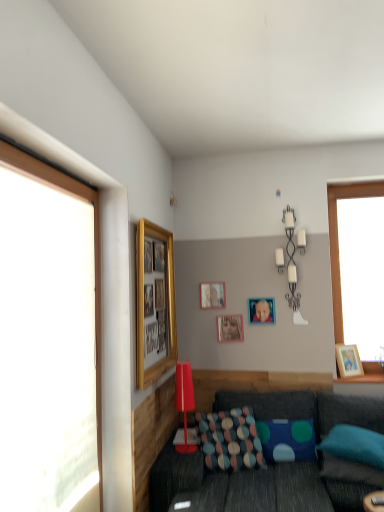
Image resolution: width=384 pixels, height=512 pixels. In order to click on blue fabric pillow at lower right, which is counted as the 3th pillow, starting from the left in this screenshot , I will do `click(355, 445)`.

What do you see at coordinates (184, 402) in the screenshot? I see `matte red lamp at center, which ranks as the 1th lamp in bottom-to-top order` at bounding box center [184, 402].

The height and width of the screenshot is (512, 384). Describe the element at coordinates (230, 439) in the screenshot. I see `textured fabric pillow at lower center, the 1th pillow positioned from the left` at that location.

Find the location of a particular element. wooden picture frame at right, the fifth picture frame in the left-to-right sequence is located at coordinates (348, 360).

What do you see at coordinates (348, 360) in the screenshot? I see `wooden picture frame at right, the fifth picture frame in the left-to-right sequence` at bounding box center [348, 360].

Find the location of a particular element. The image size is (384, 512). blue fabric pillow at lower right, the 1th pillow when ordered from right to left is located at coordinates (355, 445).

Looking at this image, between blue fabric pillow at lower right, the 1th pillow when ordered from right to left, and transparent glass window at left, which one appears on the right side from the viewer's perspective?

blue fabric pillow at lower right, the 1th pillow when ordered from right to left, is more to the right.

Is point (380, 438) in front of point (100, 342)?

No.

From a real-world perspective, between blue fabric pillow at lower right, the 1th pillow when ordered from right to left, and transparent glass window at left, who is vertically lower?

From a 3D spatial view, blue fabric pillow at lower right, the 1th pillow when ordered from right to left, is below.

Considering the sizes of objects blue fabric pillow at lower right, which is counted as the 3th pillow, starting from the left, and transparent glass window at left in the image provided, who is taller, blue fabric pillow at lower right, which is counted as the 3th pillow, starting from the left, or transparent glass window at left?

transparent glass window at left is taller.

Image resolution: width=384 pixels, height=512 pixels. Identify the location of pillow that is above the textured fabric pillow at lower center, the third pillow viewed from the right (from a real-world perspective). pyautogui.click(x=355, y=445).

Between blue fabric pillow at lower right, the 1th pillow when ordered from right to left, and textured fabric pillow at lower center, the third pillow viewed from the right, which one is positioned in front?

blue fabric pillow at lower right, the 1th pillow when ordered from right to left.

Are blue fabric pillow at lower right, the 1th pillow when ordered from right to left, and textured fabric pillow at lower center, the 1th pillow positioned from the left, located far from each other?

No.

Is blue fabric pillow at lower right, which is counted as the 3th pillow, starting from the left, spatially inside textured fabric pillow at lower center, the 1th pillow positioned from the left, or outside of it?

blue fabric pillow at lower right, which is counted as the 3th pillow, starting from the left, is spatially situated outside textured fabric pillow at lower center, the 1th pillow positioned from the left.

What's the angular difference between gold/glossy picture frame at upper left, acting as the fifth picture frame starting from the back, and textured fabric pillow at lower center, the third pillow viewed from the right,'s facing directions?

The angular difference between gold/glossy picture frame at upper left, acting as the fifth picture frame starting from the back, and textured fabric pillow at lower center, the third pillow viewed from the right, is 75.9 degrees.

Based on their positions, is gold/glossy picture frame at upper left, the 1th picture frame viewed from the front, located to the left or right of textured fabric pillow at lower center, the 1th pillow positioned from the left?

gold/glossy picture frame at upper left, the 1th picture frame viewed from the front, is to the left of textured fabric pillow at lower center, the 1th pillow positioned from the left.

Based on their sizes in the image, would you say gold/glossy picture frame at upper left, which appears as the first picture frame when viewed from the left, is bigger or smaller than textured fabric pillow at lower center, the 1th pillow positioned from the left?

gold/glossy picture frame at upper left, which appears as the first picture frame when viewed from the left, is bigger than textured fabric pillow at lower center, the 1th pillow positioned from the left.

Can we say blue fabric pillow at lower right, which is counted as the 3th pillow, starting from the left, lies outside gold/glossy picture frame at upper left, the 1th picture frame viewed from the front?

Yes, blue fabric pillow at lower right, which is counted as the 3th pillow, starting from the left, is not within gold/glossy picture frame at upper left, the 1th picture frame viewed from the front.

Is blue fabric pillow at lower right, which is counted as the 3th pillow, starting from the left, in contact with gold/glossy picture frame at upper left, arranged as the fifth picture frame when viewed from the right?

No, blue fabric pillow at lower right, which is counted as the 3th pillow, starting from the left, is not touching gold/glossy picture frame at upper left, arranged as the fifth picture frame when viewed from the right.

Find the location of a particular element. the 1st picture frame behind the blue fabric pillow at lower right, which is counted as the 3th pillow, starting from the left, counting from the anchor's position is located at coordinates (155, 303).

Is point (151, 276) more distant than point (307, 433)?

No, it is not.

How many degrees apart are the facing directions of gold/glossy picture frame at upper left, arranged as the fifth picture frame when viewed from the right, and textured blue pillow at center, acting as the second pillow starting from the right?

The facing directions of gold/glossy picture frame at upper left, arranged as the fifth picture frame when viewed from the right, and textured blue pillow at center, acting as the second pillow starting from the right, are 83.6 degrees apart.

Starting from the gold/glossy picture frame at upper left, the 1th picture frame viewed from the front, which pillow is the 2nd one behind? Please provide its 2D coordinates.

[(287, 440)]

Considering the relative sizes of gold/glossy picture frame at upper left, arranged as the fifth picture frame when viewed from the right, and textured blue pillow at center, acting as the second pillow starting from the right, in the image provided, is gold/glossy picture frame at upper left, arranged as the fifth picture frame when viewed from the right, thinner than textured blue pillow at center, acting as the second pillow starting from the right,?

Yes, gold/glossy picture frame at upper left, arranged as the fifth picture frame when viewed from the right, is thinner than textured blue pillow at center, acting as the second pillow starting from the right.

Considering the positions of objects transparent glass window at left and matte gold picture frame at upper center, the 2th picture frame viewed from the left, in the image provided, who is behind, transparent glass window at left or matte gold picture frame at upper center, the 2th picture frame viewed from the left,?

matte gold picture frame at upper center, the 2th picture frame viewed from the left, is more distant.

Is matte gold picture frame at upper center, arranged as the 1th picture frame when viewed from the back, located within transparent glass window at left?

No, transparent glass window at left does not contain matte gold picture frame at upper center, arranged as the 1th picture frame when viewed from the back.

How distant is transparent glass window at left from matte gold picture frame at upper center, the 2th picture frame viewed from the left?

They are 1.50 meters apart.

Between transparent glass window at left and matte gold picture frame at upper center, arranged as the 1th picture frame when viewed from the back, which one has smaller width?

With smaller width is matte gold picture frame at upper center, arranged as the 1th picture frame when viewed from the back.

Considering the relative sizes of metallic silver photo frame at center, which appears as the fourth picture frame when viewed from the left, and matte red lamp at center, arranged as the 2th lamp when viewed from the right, in the image provided, is metallic silver photo frame at center, which appears as the fourth picture frame when viewed from the left, taller than matte red lamp at center, arranged as the 2th lamp when viewed from the right,?

In fact, metallic silver photo frame at center, which appears as the fourth picture frame when viewed from the left, may be shorter than matte red lamp at center, arranged as the 2th lamp when viewed from the right.

Is metallic silver photo frame at center, acting as the 2th picture frame starting from the right, at the left side of matte red lamp at center, arranged as the 1th lamp when viewed from the front?

In fact, metallic silver photo frame at center, acting as the 2th picture frame starting from the right, is to the right of matte red lamp at center, arranged as the 1th lamp when viewed from the front.

How much distance is there between metallic silver photo frame at center, acting as the 2th picture frame starting from the right, and matte red lamp at center, arranged as the 2th lamp when viewed from the back?

metallic silver photo frame at center, acting as the 2th picture frame starting from the right, is 36.85 inches away from matte red lamp at center, arranged as the 2th lamp when viewed from the back.

Between metallic silver photo frame at center, the third picture frame viewed from the back, and matte red lamp at center, arranged as the 2th lamp when viewed from the back, which one has larger width?

Wider between the two is matte red lamp at center, arranged as the 2th lamp when viewed from the back.

From a real-world perspective, starting from the transparent glass window at left, which pillow is the 1st one below it? Please provide its 2D coordinates.

[(355, 445)]

Starting from the blue fabric pillow at lower right, the 1th pillow when ordered from right to left, which pillow is the 2nd one to the left? Please provide its 2D coordinates.

[(230, 439)]

When comparing their distances from transparent glass window at left, does wooden picture frame at right, marked as the second picture frame in a front-to-back arrangement, or matte gold picture frame at upper center, arranged as the 1th picture frame when viewed from the back, seem further?

wooden picture frame at right, marked as the second picture frame in a front-to-back arrangement, lies further to transparent glass window at left than the other object.

Estimate the real-world distances between objects in this image. Which object is further from gold/glossy picture frame at upper left, acting as the fifth picture frame starting from the back, matte gold picture frame at upper center, which appears as the 4th picture frame when viewed from the right, or textured fabric pillow at lower center, the 1th pillow positioned from the left?

The object further to gold/glossy picture frame at upper left, acting as the fifth picture frame starting from the back, is textured fabric pillow at lower center, the 1th pillow positioned from the left.

From the image, which object appears to be nearer to metallic silver photo frame at center, which appears as the fourth picture frame when viewed from the left, matte gold picture frame at upper center, the 2th picture frame viewed from the left, or gold/glossy picture frame at upper left, acting as the fifth picture frame starting from the back?

matte gold picture frame at upper center, the 2th picture frame viewed from the left.

Considering their positions, is wooden picture frame at right, marked as the 4th picture frame in a back-to-front arrangement, positioned further to matte gold picture frame at upper center, the 5th picture frame in the front-to-back sequence, than gold/glossy picture frame at upper left, acting as the fifth picture frame starting from the back?

wooden picture frame at right, marked as the 4th picture frame in a back-to-front arrangement.

Based on their spatial positions, is wooden picture frame at right, the fifth picture frame in the left-to-right sequence, or metallic silver photo frame at center, which is the third picture frame from front to back, closer to textured fabric pillow at lower center, the 1th pillow positioned from the left?

metallic silver photo frame at center, which is the third picture frame from front to back, is positioned closer to the anchor textured fabric pillow at lower center, the 1th pillow positioned from the left.

Considering their positions, is textured blue pillow at center, acting as the second pillow starting from the right, positioned closer to matte gold picture frame at upper center, the 5th picture frame in the front-to-back sequence, than transparent glass window at left?

Based on the image, textured blue pillow at center, acting as the second pillow starting from the right, appears to be nearer to matte gold picture frame at upper center, the 5th picture frame in the front-to-back sequence.

Which object lies further to the anchor point matte gold picture frame at upper center, the 2th picture frame viewed from the left, matte red lamp at center, the first lamp when ordered from left to right, or blue fabric pillow at lower right, which is counted as the 3th pillow, starting from the left?

blue fabric pillow at lower right, which is counted as the 3th pillow, starting from the left, is further to matte gold picture frame at upper center, the 2th picture frame viewed from the left.

From the image, which object appears to be nearer to wooden picture frame at right, marked as the 4th picture frame in a back-to-front arrangement, matte red lamp at center, which ranks as the 1th lamp in bottom-to-top order, or textured gray couch at lower center?

textured gray couch at lower center is closer to wooden picture frame at right, marked as the 4th picture frame in a back-to-front arrangement.

Where is `pillow between metallic silver candle holder at upper center, which is counted as the 2th lamp, starting from the left, and textured fabric pillow at lower center, the 1th pillow positioned from the left, in the vertical direction`? This screenshot has height=512, width=384. pillow between metallic silver candle holder at upper center, which is counted as the 2th lamp, starting from the left, and textured fabric pillow at lower center, the 1th pillow positioned from the left, in the vertical direction is located at coordinates (355, 445).

Where is `window located between textured gray couch at lower center and gold/glossy picture frame at upper left, arranged as the fifth picture frame when viewed from the right, in the depth direction`? The image size is (384, 512). window located between textured gray couch at lower center and gold/glossy picture frame at upper left, arranged as the fifth picture frame when viewed from the right, in the depth direction is located at coordinates (95, 256).

Locate an element on the screen. pillow positioned between textured gray couch at lower center and gold/glossy picture frame at upper left, which appears as the first picture frame when viewed from the left, from near to far is located at coordinates (355, 445).

Where is `lamp between transparent glass window at left and metallic silver candle holder at upper center, which appears as the second lamp when viewed from the front, in the front-back direction`? Image resolution: width=384 pixels, height=512 pixels. lamp between transparent glass window at left and metallic silver candle holder at upper center, which appears as the second lamp when viewed from the front, in the front-back direction is located at coordinates (184, 402).